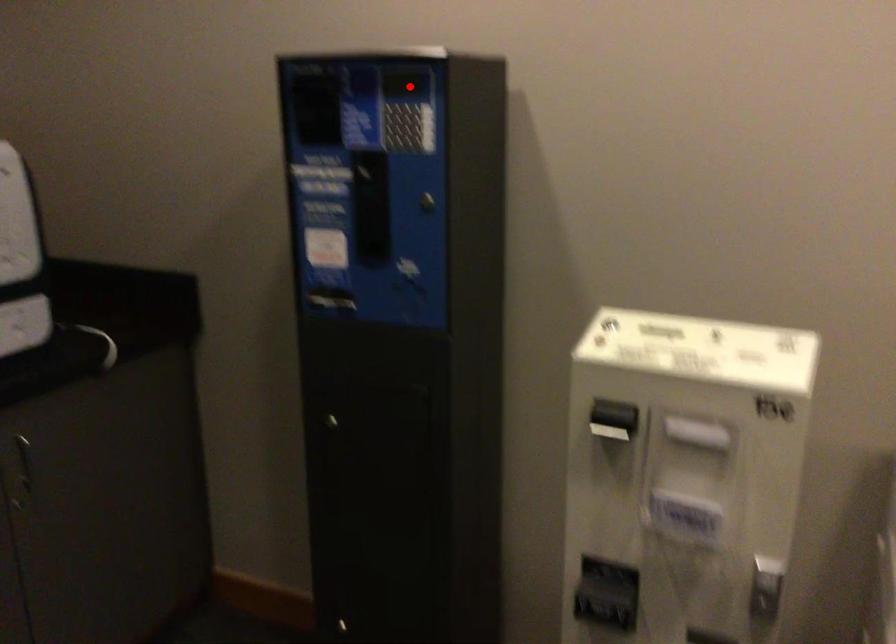
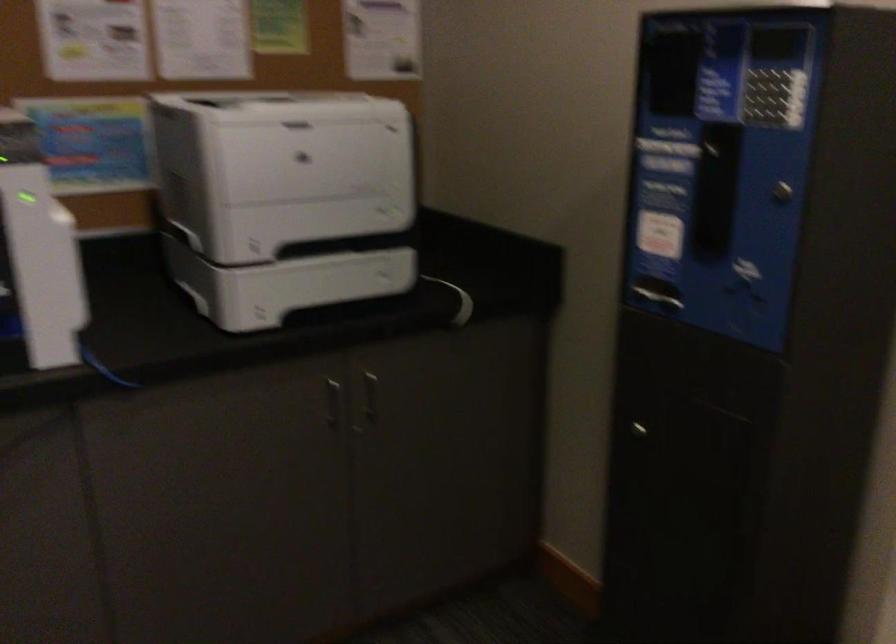
Question: I am providing you with two images of the same scene from different viewpoints. Given a red point in image1, look at the same physical point in image2. Is it:

Choices:
 (A) Closer to the viewpoint
 (B) Farther from the viewpoint

Answer: (A)